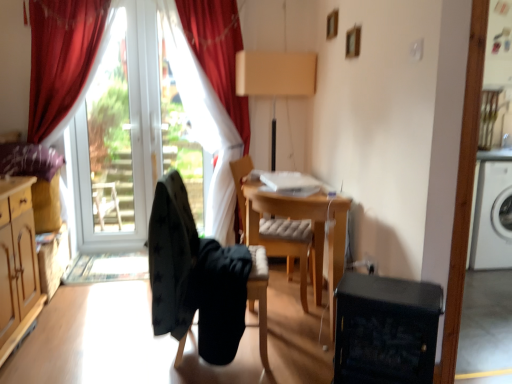
Question: Is wooden desk at center not close to white glass door at left?

Choices:
 (A) no
 (B) yes

Answer: (B)

Question: Does wooden desk at center have a lesser width compared to white glass door at left?

Choices:
 (A) yes
 (B) no

Answer: (B)

Question: From the image's perspective, would you say wooden desk at center is positioned over white glass door at left?

Choices:
 (A) no
 (B) yes

Answer: (A)

Question: Considering the relative positions of wooden desk at center and white glass door at left in the image provided, is wooden desk at center in front of white glass door at left?

Choices:
 (A) yes
 (B) no

Answer: (A)

Question: Is wooden desk at center beside white glass door at left?

Choices:
 (A) no
 (B) yes

Answer: (A)

Question: Considering the relative sizes of wooden desk at center and white glass door at left in the image provided, is wooden desk at center shorter than white glass door at left?

Choices:
 (A) yes
 (B) no

Answer: (A)

Question: Is white glass door at left beside black fabric chair at center, the first chair viewed from the front?

Choices:
 (A) yes
 (B) no

Answer: (B)

Question: Is white glass door at left far away from black fabric chair at center, the first chair viewed from the front?

Choices:
 (A) no
 (B) yes

Answer: (B)

Question: Does white glass door at left appear on the left side of black fabric chair at center, the first chair viewed from the front?

Choices:
 (A) no
 (B) yes

Answer: (B)

Question: Is white glass door at left turned away from black fabric chair at center, the first chair viewed from the front?

Choices:
 (A) no
 (B) yes

Answer: (A)

Question: Does white glass door at left have a smaller size compared to black fabric chair at center, the first chair viewed from the front?

Choices:
 (A) no
 (B) yes

Answer: (B)

Question: From the image's perspective, is white glass door at left below black fabric chair at center, the first chair viewed from the front?

Choices:
 (A) no
 (B) yes

Answer: (A)

Question: Is velvet red curtain at upper left, the 2th curtain when ordered from left to right, looking in the opposite direction of wooden desk at center?

Choices:
 (A) yes
 (B) no

Answer: (B)